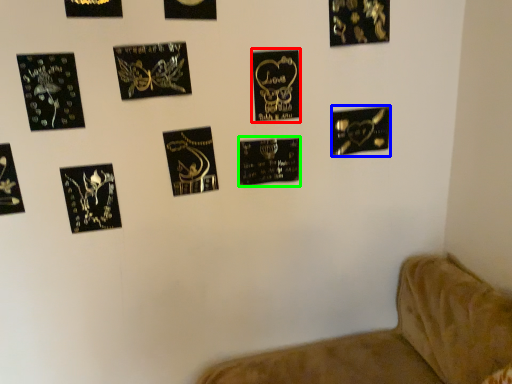
Question: Estimate the real-world distances between objects in this image. Which object is closer to picture frame (highlighted by a red box), picture frame (highlighted by a blue box) or picture frame (highlighted by a green box)?

Choices:
 (A) picture frame
 (B) picture frame

Answer: (B)